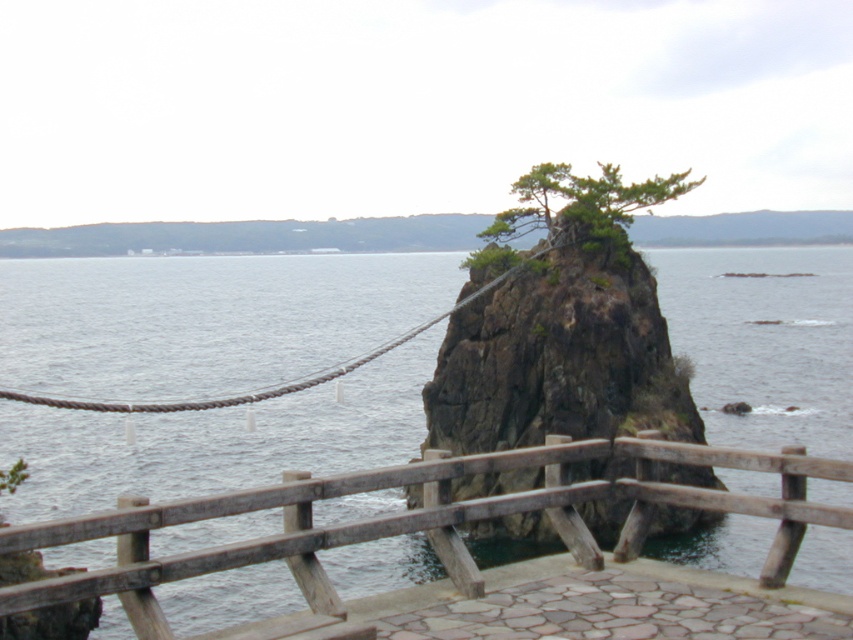
Question: Is wooden rail at center in front of green rough textured tree at center?

Choices:
 (A) no
 (B) yes

Answer: (B)

Question: Which point appears farthest from the camera in this image?

Choices:
 (A) (631, 454)
 (B) (680, 392)

Answer: (B)

Question: Which is nearer to the green rough textured tree at center?

Choices:
 (A) wooden rail at center
 (B) rough textured rock at center

Answer: (B)

Question: Is wooden rail at center below rough textured rock at center?

Choices:
 (A) no
 (B) yes

Answer: (B)

Question: Which object is positioned farthest from the wooden rail at center?

Choices:
 (A) green rough textured tree at center
 (B) rough textured rock at center

Answer: (A)

Question: Is wooden rail at center further to camera compared to green rough textured tree at center?

Choices:
 (A) yes
 (B) no

Answer: (B)